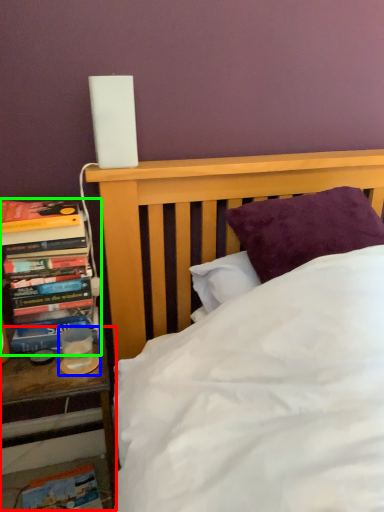
Question: Based on their relative distances, which object is farther from nightstand (highlighted by a red box)? Choose from candle holder (highlighted by a blue box) and book (highlighted by a green box).

Choices:
 (A) candle holder
 (B) book

Answer: (B)